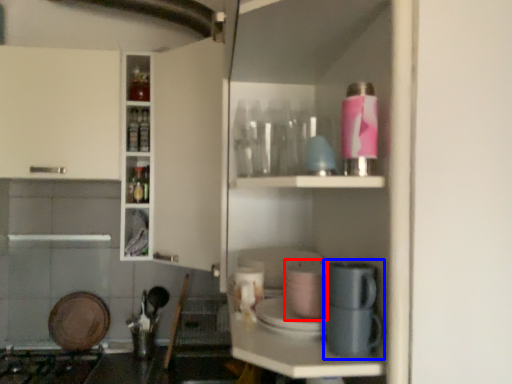
Question: Among these objects, which one is nearest to the camera, appliance (highlighted by a red box) or coffee machine (highlighted by a blue box)?

Choices:
 (A) appliance
 (B) coffee machine

Answer: (B)